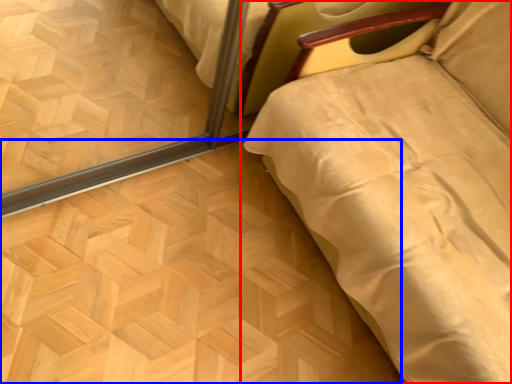
Question: Which object appears closest to the camera in this image, furniture (highlighted by a red box) or plywood (highlighted by a blue box)?

Choices:
 (A) furniture
 (B) plywood

Answer: (A)